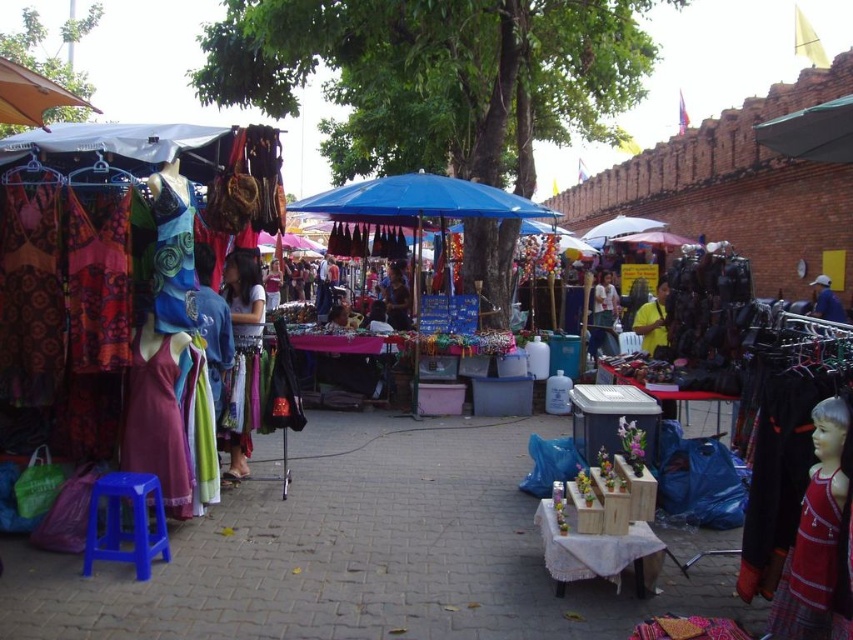
Does matte green dress at center have a larger size compared to yellow cotton shirt at center?

Actually, matte green dress at center might be smaller than yellow cotton shirt at center.

Can you confirm if matte green dress at center is positioned to the left of yellow cotton shirt at center?

Yes, matte green dress at center is to the left of yellow cotton shirt at center.

Between point (241, 317) and point (651, 317), which one is positioned behind?

The point (651, 317) is behind.

Find the location of a particular element. The image size is (853, 640). matte green dress at center is located at coordinates tap(251, 316).

Between blue plastic stool at lower left and matte black bag at center, which one has less height?

Standing shorter between the two is matte black bag at center.

Can you confirm if blue plastic stool at lower left is shorter than matte black bag at center?

No.

Describe the element at coordinates (120, 522) in the screenshot. I see `blue plastic stool at lower left` at that location.

Where is `blue plastic stool at lower left`? blue plastic stool at lower left is located at coordinates (120, 522).

Looking at this image, does red woven dress at lower right come in front of blue fabric umbrella at center?

That is True.

Is red woven dress at lower right shorter than blue fabric umbrella at center?

No, red woven dress at lower right is not shorter than blue fabric umbrella at center.

Who is more forward, (838,531) or (340,195)?

Positioned in front is point (838,531).

Find the location of a particular element. This screenshot has height=640, width=853. red woven dress at lower right is located at coordinates (816, 564).